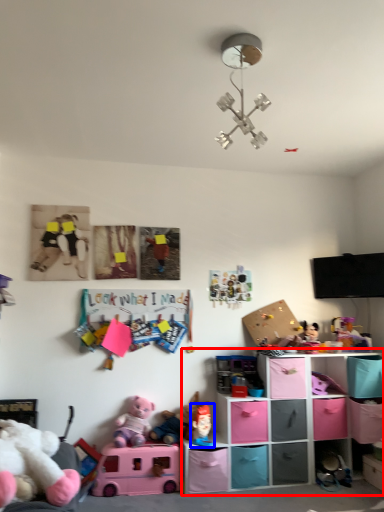
Question: Which object is further to the camera taking this photo, shelf (highlighted by a red box) or toy (highlighted by a blue box)?

Choices:
 (A) shelf
 (B) toy

Answer: (B)